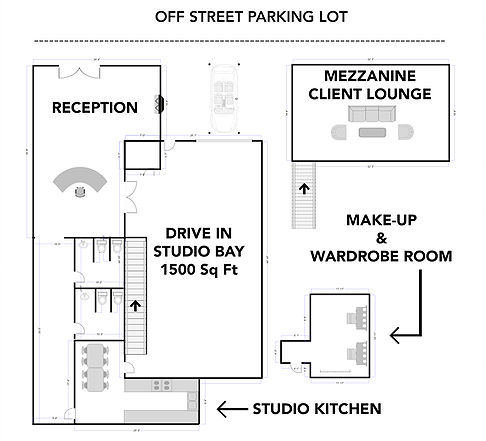
I want to click on stove burner, so click(x=156, y=381), click(x=166, y=381), click(x=155, y=388), click(x=164, y=387).